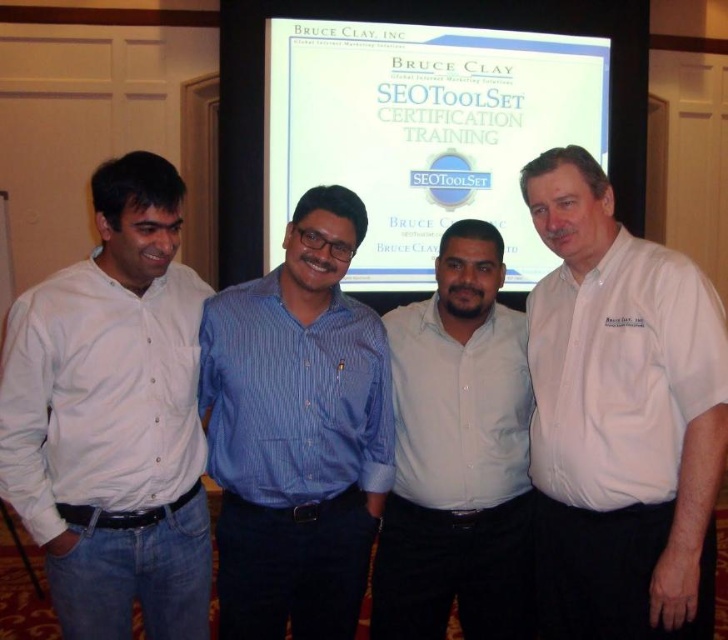
Question: Considering the real-world distances, which object is closest to the blue striped shirt at center?

Choices:
 (A) white cotton shirt at left
 (B) white shirt at center

Answer: (A)

Question: Which object is positioned farthest from the white cotton shirt at center?

Choices:
 (A) white glossy projector screen at upper center
 (B) white shirt at center
 (C) white cotton shirt at left

Answer: (A)

Question: Is white glossy projector screen at upper center below white shirt at center?

Choices:
 (A) yes
 (B) no

Answer: (B)

Question: Does white cotton shirt at left have a smaller size compared to white shirt at center?

Choices:
 (A) no
 (B) yes

Answer: (A)

Question: Which object is positioned farthest from the white cotton shirt at left?

Choices:
 (A) blue striped shirt at center
 (B) white glossy projector screen at upper center
 (C) white shirt at center
 (D) white cotton shirt at center

Answer: (B)

Question: Can you confirm if white cotton shirt at center is wider than white glossy projector screen at upper center?

Choices:
 (A) no
 (B) yes

Answer: (A)